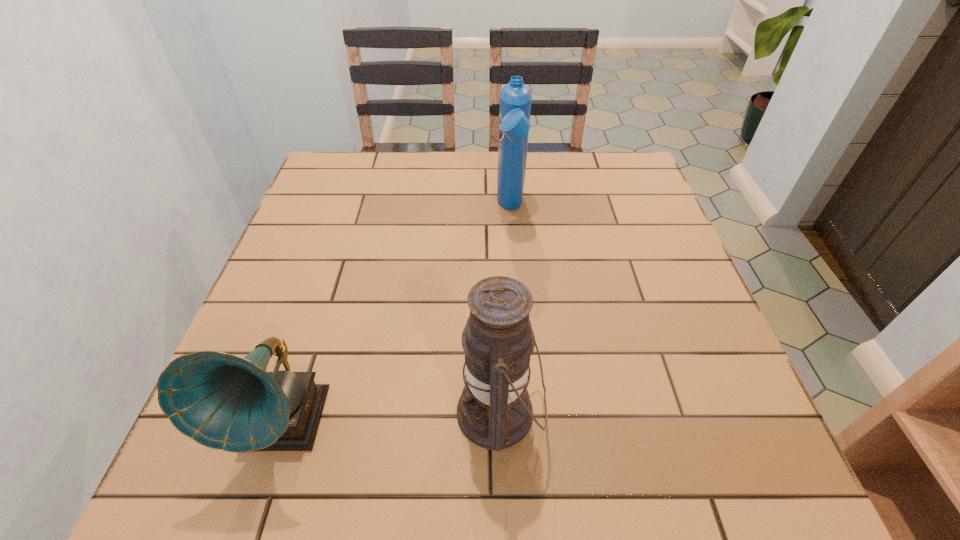
You are a GUI agent. You are given a task and a screenshot of the screen. Output one action in this format:
    pyautogui.click(x=<x>, y=<y>)
    Task: Click on the object that is at the near left corner
    
    Given the screenshot: What is the action you would take?
    pyautogui.click(x=222, y=401)

The width and height of the screenshot is (960, 540). What are the coordinates of `free space at the far edge of the desktop` in the screenshot? It's located at (552, 169).

At what (x,y) coordinates should I click in order to perform the action: click on blank space at the left edge of the desktop. Please return your answer as a coordinate pair (x, y). The image size is (960, 540). Looking at the image, I should click on (335, 208).

Identify the location of vacant space at the right edge. This screenshot has width=960, height=540. point(672,440).

In order to click on vacant space at the far left corner of the desktop in this screenshot , I will do `click(345, 171)`.

Locate an element on the screen. free space at the near right corner of the desktop is located at coordinates (734, 451).

You are a GUI agent. You are given a task and a screenshot of the screen. Output one action in this format:
    pyautogui.click(x=<x>, y=<y>)
    Task: Click on the free space between the leftmost object and the farthest object
    This screenshot has height=540, width=960.
    Given the screenshot: What is the action you would take?
    (397, 316)

Find the location of a particular element. unoccupied position between the leftmost object and the shampoo is located at coordinates (397, 316).

Find the location of a particular element. This screenshot has width=960, height=540. free spot between the oil lamp and the phonograph_record is located at coordinates [392, 418].

At what (x,y) coordinates should I click in order to perform the action: click on vacant space in between the shortest object and the oil lamp. Please return your answer as a coordinate pair (x, y). Looking at the image, I should click on (392, 418).